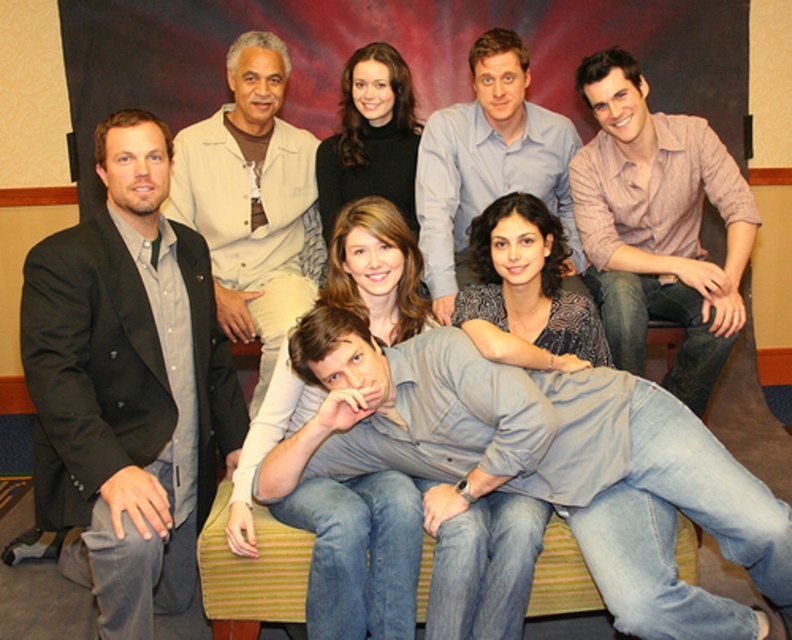
Question: Which point is farther from the camera taking this photo?

Choices:
 (A) (94, 483)
 (B) (716, 508)
 (C) (485, 154)
 (D) (680, 291)

Answer: (C)

Question: Which object appears closest to the camera in this image?

Choices:
 (A) pink striped shirt at upper right
 (B) denim jeans at lower right
 (C) beige textured shirt at upper center

Answer: (B)

Question: Which point is closer to the camera?

Choices:
 (A) (495, 161)
 (B) (596, 188)

Answer: (B)

Question: Does dark gray suit at left appear on the right side of pink striped shirt at upper right?

Choices:
 (A) yes
 (B) no

Answer: (B)

Question: Does pink striped shirt at upper right appear on the left side of light blue shirt at center?

Choices:
 (A) yes
 (B) no

Answer: (B)

Question: From the image, what is the correct spatial relationship of denim jeans at lower right in relation to pink striped shirt at upper right?

Choices:
 (A) below
 (B) above

Answer: (A)